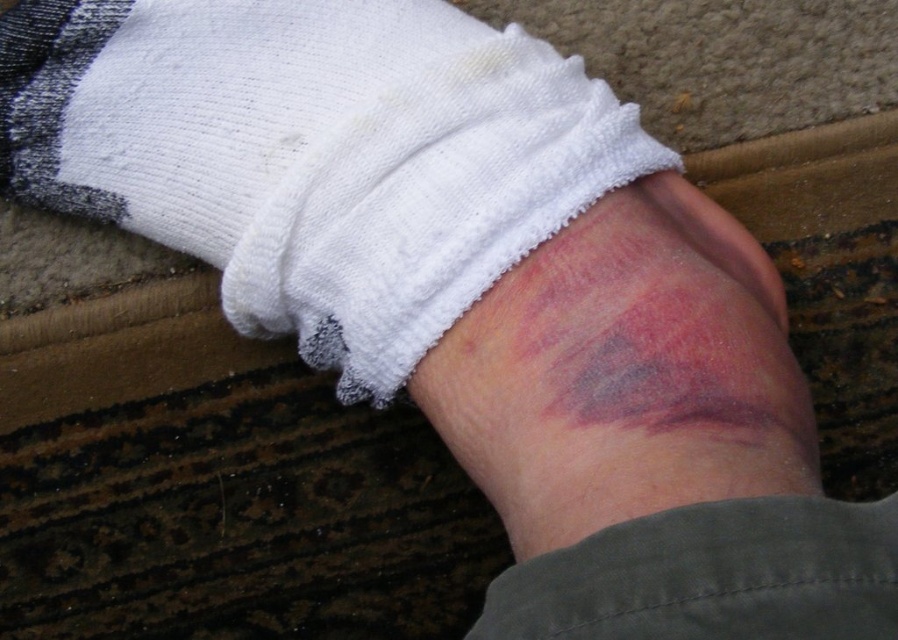
In the scene shown: Can you confirm if white terry cloth sock at center is positioned to the right of purple bruised skin at center?

Incorrect, white terry cloth sock at center is not on the right side of purple bruised skin at center.

Who is positioned more to the right, white terry cloth sock at center or purple bruised skin at center?

From the viewer's perspective, purple bruised skin at center appears more on the right side.

Who is more distant from viewer, [133,192] or [706,250]?

The point [133,192] is more distant.

I want to click on white terry cloth sock at center, so click(x=314, y=154).